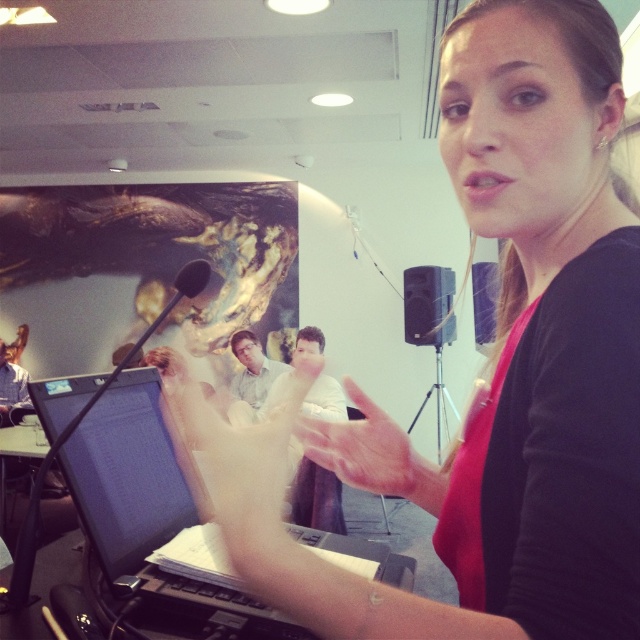
Looking at this image, who is taller, matte black laptop at center or purple fabric at center?

With more height is purple fabric at center.

Measure the distance between matte black laptop at center and purple fabric at center.

matte black laptop at center and purple fabric at center are 3.72 meters apart.

Locate an element on the screen. This screenshot has width=640, height=640. matte black laptop at center is located at coordinates (497, 369).

Which is below, matte black speaker at center or purple fabric at center?

purple fabric at center is below.

Who is more distant from viewer, (x=424, y=320) or (x=477, y=266)?

The point (x=424, y=320) is more distant.

Where is `matte black speaker at center`? This screenshot has height=640, width=640. matte black speaker at center is located at coordinates coord(428,305).

Is matte black laptop at center bigger than matte black speaker at center?

Incorrect, matte black laptop at center is not larger than matte black speaker at center.

Which is behind, point (512, 516) or point (433, 333)?

The point (433, 333) is more distant.

Is point (589, 413) positioned after point (426, 288)?

No, (589, 413) is in front of (426, 288).

This screenshot has height=640, width=640. I want to click on matte black laptop at center, so (x=497, y=369).